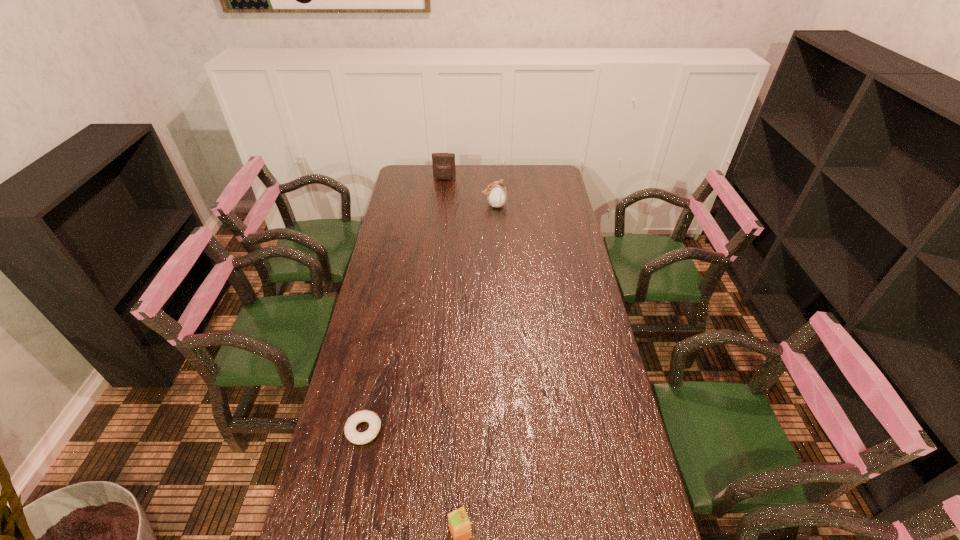
At what (x,y) coordinates should I click in order to perform the action: click on vacant point located between the farthest object and the right pouch. Please return your answer as a coordinate pair (x, y). This screenshot has height=540, width=960. Looking at the image, I should click on (469, 192).

Image resolution: width=960 pixels, height=540 pixels. Identify the location of free point between the second object from left to right and the nearer pouch. (469, 192).

Identify which object is the second closest to the second object from left to right. Please provide its 2D coordinates. Your answer should be formatted as a tuple, i.e. [(x, y)], where the tuple contains the x and y coordinates of a point satisfying the conditions above.

[(351, 433)]

The width and height of the screenshot is (960, 540). Identify the location of object that can be found as the second closest to the third farthest object. (496, 192).

The height and width of the screenshot is (540, 960). Find the location of `free region that satisfies the following two spatial constraints: 1. on the front-facing side of the second farthest object; 2. on the front side of the second nearest object`. free region that satisfies the following two spatial constraints: 1. on the front-facing side of the second farthest object; 2. on the front side of the second nearest object is located at coordinates (503, 430).

The image size is (960, 540). Identify the location of free space that satisfies the following two spatial constraints: 1. on the front-facing side of the rightmost object; 2. on the front side of the shortest object. (503, 430).